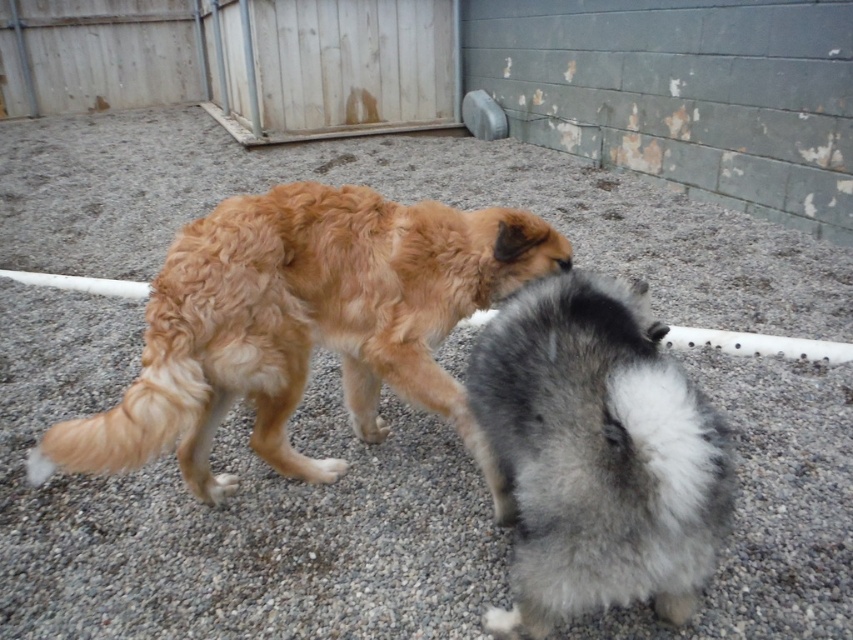
Does golden fur dog at center appear over fluffy gray fur at center?

Yes.

Can you confirm if golden fur dog at center is thinner than fluffy gray fur at center?

No, golden fur dog at center is not thinner than fluffy gray fur at center.

I want to click on golden fur dog at center, so click(305, 324).

You are a GUI agent. You are given a task and a screenshot of the screen. Output one action in this format:
    pyautogui.click(x=<x>, y=<y>)
    Task: Click on the golden fur dog at center
    The image size is (853, 640).
    Given the screenshot: What is the action you would take?
    pyautogui.click(x=305, y=324)

Looking at this image, can you confirm if golden fur dog at center is shorter than white fluffy paw at center?

In fact, golden fur dog at center may be taller than white fluffy paw at center.

Locate an element on the screen. golden fur dog at center is located at coordinates (305, 324).

Between point (517, 348) and point (314, 465), which one is positioned behind?

The point (314, 465) is behind.

At what (x,y) coordinates should I click in order to perform the action: click on fluffy gray fur at center. Please return your answer as a coordinate pair (x, y). The width and height of the screenshot is (853, 640). Looking at the image, I should click on (596, 454).

Where is `fluffy gray fur at center`? fluffy gray fur at center is located at coordinates (596, 454).